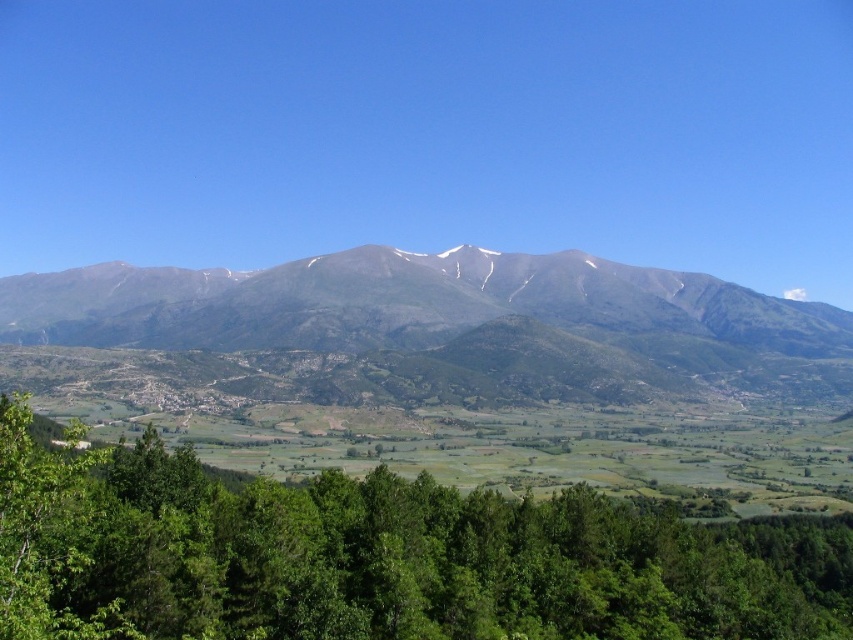
You are standing in the forest looking towards the mountains. You see a green leafy tree at lower center and a gray rocky mountain range at center. Which object is positioned to the left when facing the mountains?

The green leafy tree at lower center is positioned to the left of the gray rocky mountain range at center.

You are standing at the point marked as point (378, 557) in the image. What is the nearest object to you in the scene?

The nearest object to you at point (378, 557) is the green leafy tree at lower center.

You are a hiker standing at the base of the green leafy tree at lower center. You want to reach the gray rocky mountain range at center. Which object will you see getting closer as you hike towards the mountain?

As you hike towards the gray rocky mountain range at center, the green leafy tree at lower center will appear to get smaller in your view, while the mountain range grows larger. However, the question asks which object you will see getting closer. Since you are starting at the tree, the tree is already close, and the mountain is far away. As you move towards the mountain, the distance to the mountain decreases, so the gray rocky mountain range at center will be the object you see getting closer as you hike.